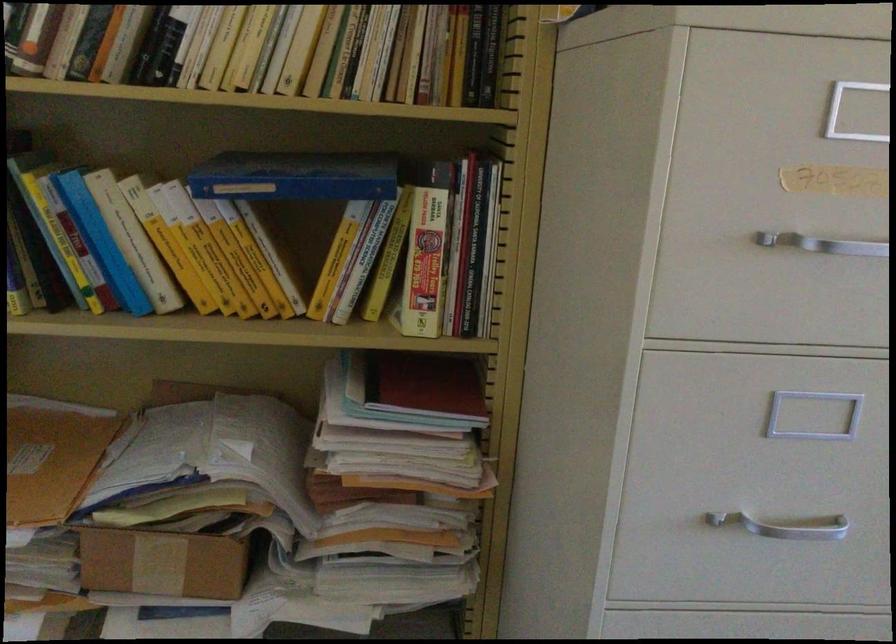
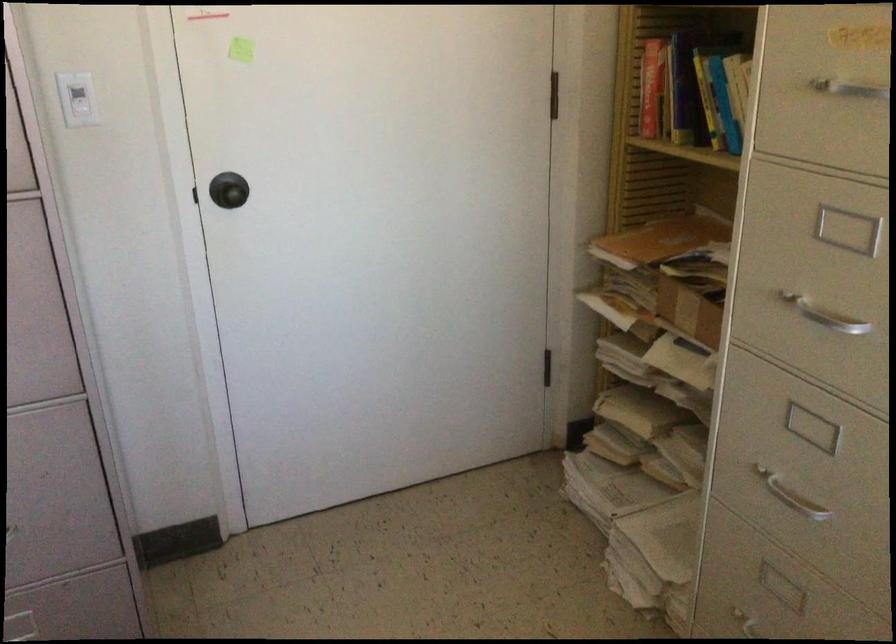
Find the pixel in the second image that matches pixel 776 230 in the first image.

(839, 82)